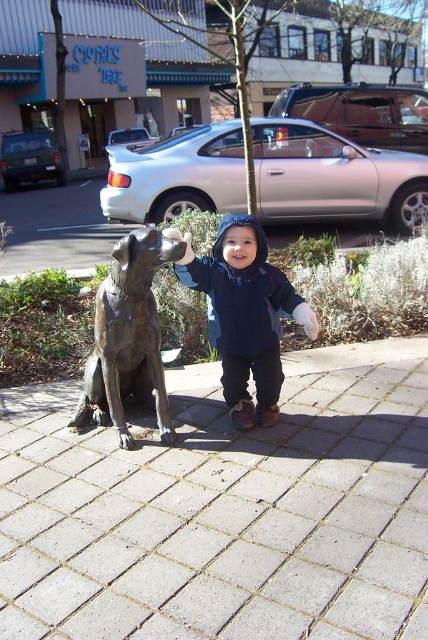
Based on the photo, you are standing at the front of the bronze statue at left and want to walk to the paved stone pavement at center. Which direction should you face to move towards it?

Since the paved stone pavement at center is closer to the viewer than the bronze statue at left, you should face towards the direction of the viewer to move towards the paved stone pavement at center.

You are standing at the point labeled point (107, 333) and want to walk to the point labeled point (261, 356). Which direction should you face to move towards your destination?

You should face north because point (261, 356) is behind point (107, 333).